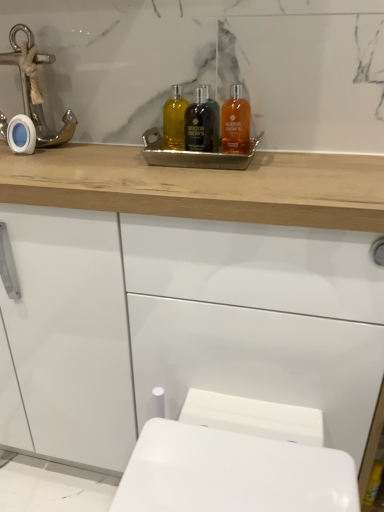
Locate an element on the screen. The image size is (384, 512). vacant space in front of metallic tray at center is located at coordinates (218, 176).